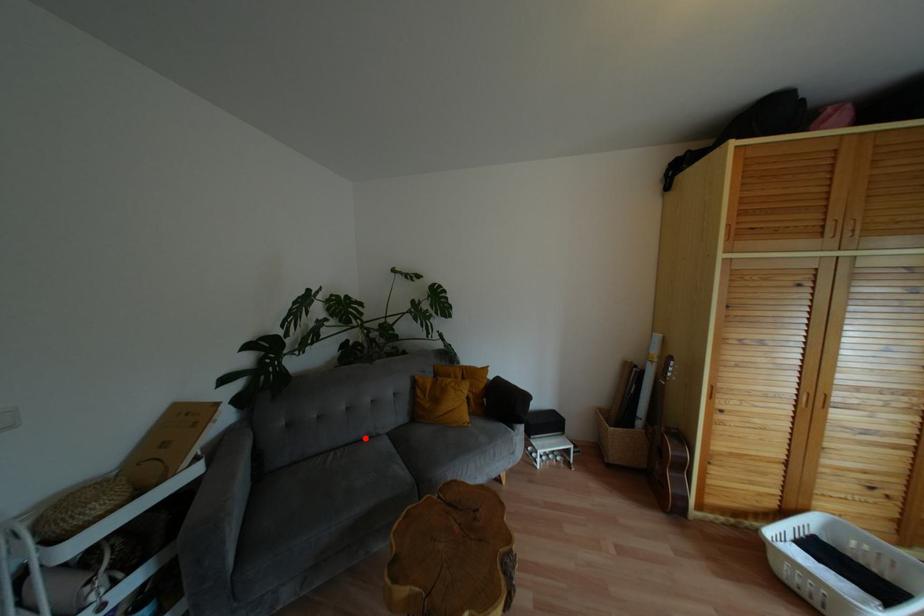
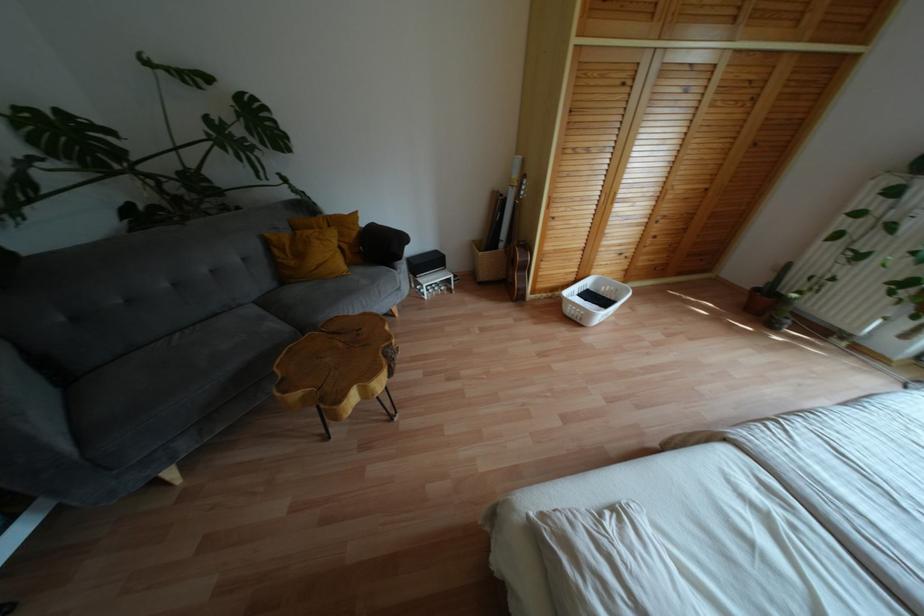
Question: A red point is marked in image1. In image2, is the corresponding 3D point closer to the camera or farther? Reply with the corresponding letter.

Choices:
 (A) The corresponding 3D point is closer.
 (B) The corresponding 3D point is farther.

Answer: (A)